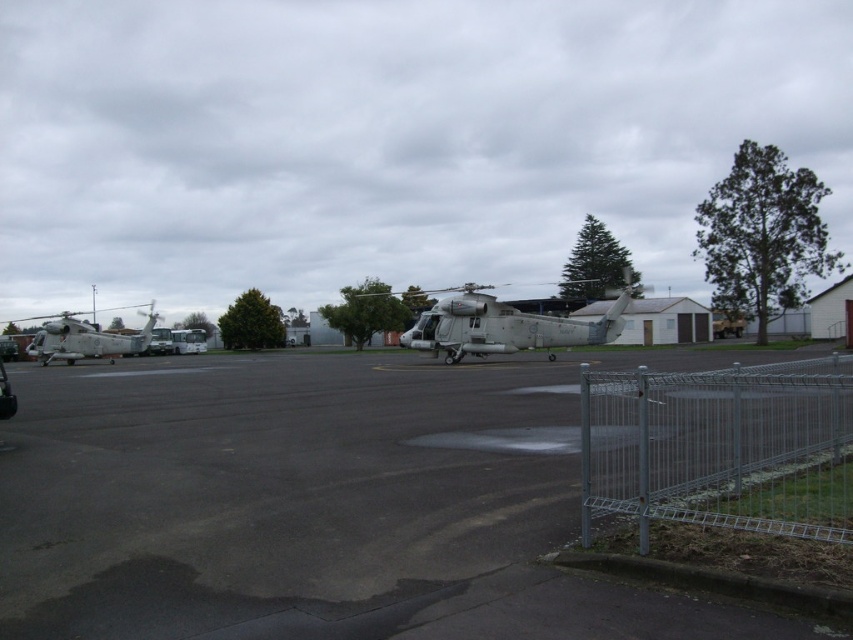
Question: Which object is positioned farthest from the silver wire mesh fence at lower right?

Choices:
 (A) metallic gray helicopter at left
 (B) dark gray asphalt at center

Answer: (A)

Question: Which object is positioned closest to the metallic gray helicopter at left?

Choices:
 (A) dark gray asphalt at center
 (B) silver wire mesh fence at lower right

Answer: (A)

Question: Which of these objects is positioned farthest from the gray metallic helicopter at center?

Choices:
 (A) metallic gray helicopter at left
 (B) silver wire mesh fence at lower right

Answer: (A)

Question: Is dark gray asphalt at center closer to the viewer compared to silver wire mesh fence at lower right?

Choices:
 (A) yes
 (B) no

Answer: (A)

Question: Does silver wire mesh fence at lower right appear on the right side of gray metallic helicopter at center?

Choices:
 (A) yes
 (B) no

Answer: (B)

Question: Is silver wire mesh fence at lower right positioned behind metallic gray helicopter at left?

Choices:
 (A) no
 (B) yes

Answer: (A)